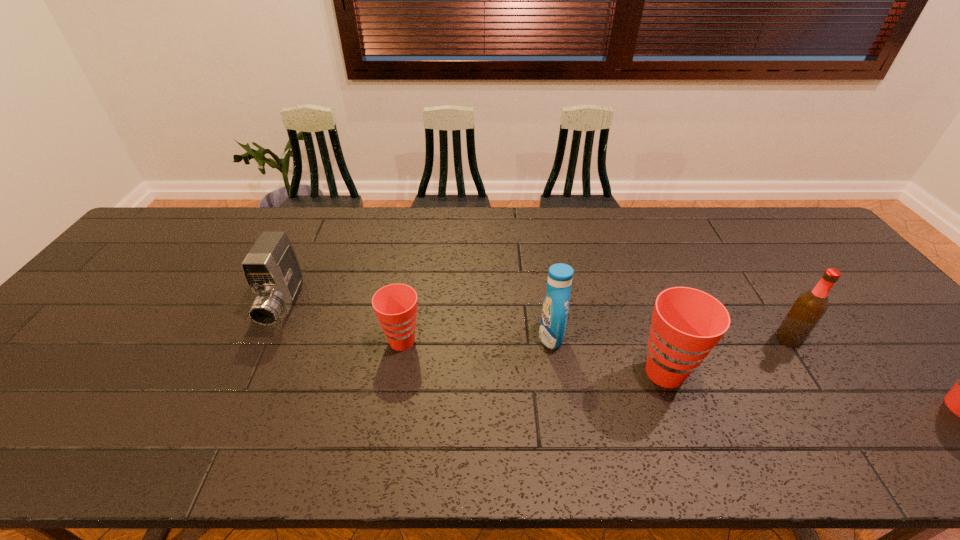
In order to click on the shortest object in this screenshot , I will do `click(395, 305)`.

At what (x,y) coordinates should I click in order to perform the action: click on the second object from left to right. Please return your answer as a coordinate pair (x, y). Looking at the image, I should click on (395, 305).

Identify the location of the taller cup. (687, 323).

You are a GUI agent. You are given a task and a screenshot of the screen. Output one action in this format:
    pyautogui.click(x=<x>, y=<y>)
    Task: Click on the right cup
    
    Given the screenshot: What is the action you would take?
    pyautogui.click(x=687, y=323)

The height and width of the screenshot is (540, 960). I want to click on beer bottle, so click(810, 306).

I want to click on the third object from right to left, so click(555, 308).

Where is `the leftmost object`? Image resolution: width=960 pixels, height=540 pixels. the leftmost object is located at coordinates (271, 269).

Find the location of a particular element. This screenshot has height=540, width=960. free space located 0.280m on the right of the shorter cup is located at coordinates (533, 341).

The height and width of the screenshot is (540, 960). What are the coordinates of `free point located on the left of the taller cup` in the screenshot? It's located at (545, 373).

Where is `blank area located 0.220m on the right of the rightmost object`? The image size is (960, 540). blank area located 0.220m on the right of the rightmost object is located at coordinates (887, 339).